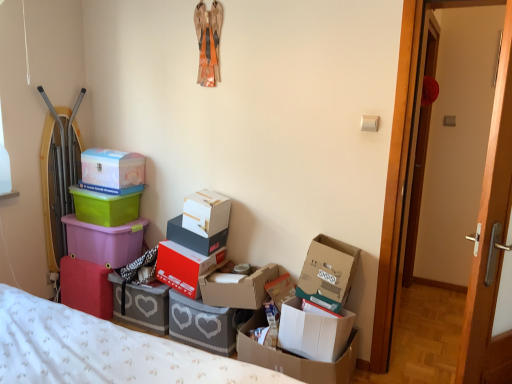
The width and height of the screenshot is (512, 384). What do you see at coordinates (105, 207) in the screenshot? I see `green plastic container at upper left, which is the 2th box from left to right` at bounding box center [105, 207].

Measure the distance between point (478, 251) and camera.

A distance of 4.92 feet exists between point (478, 251) and camera.

What do you see at coordinates (142, 304) in the screenshot?
I see `gray cardboard box at lower center, positioned as the 4th box in left-to-right order` at bounding box center [142, 304].

You are a GUI agent. You are given a task and a screenshot of the screen. Output one action in this format:
    pyautogui.click(x=<x>, y=<y>)
    Task: Click on the gray cardboard box at lower center, positioned as the 4th box in left-to-right order
    
    Given the screenshot: What is the action you would take?
    pyautogui.click(x=142, y=304)

This screenshot has height=384, width=512. What do you see at coordinates (490, 236) in the screenshot?
I see `wooden door at right, the 1th door from the back` at bounding box center [490, 236].

Image resolution: width=512 pixels, height=384 pixels. Find the location of `matte plastic storage box at left, placed as the 12th box when sorted from right to left`. matte plastic storage box at left, placed as the 12th box when sorted from right to left is located at coordinates (105, 241).

From the image's perspective, is matte white plastic box at upper left, which appears as the 3th box when viewed from the left, on gray cardboard box at center, positioned as the 5th box in right-to-left order?

Yes, from the image's perspective, matte white plastic box at upper left, which appears as the 3th box when viewed from the left, is above gray cardboard box at center, positioned as the 5th box in right-to-left order.

Considering the sizes of matte white plastic box at upper left, acting as the tenth box starting from the right, and gray cardboard box at center, positioned as the 5th box in right-to-left order, in the image, is matte white plastic box at upper left, acting as the tenth box starting from the right, wider or thinner than gray cardboard box at center, positioned as the 5th box in right-to-left order,?

matte white plastic box at upper left, acting as the tenth box starting from the right, is thinner than gray cardboard box at center, positioned as the 5th box in right-to-left order.

Which of these two, matte white plastic box at upper left, which appears as the 3th box when viewed from the left, or gray cardboard box at center, positioned as the 5th box in right-to-left order, stands shorter?

Standing shorter between the two is matte white plastic box at upper left, which appears as the 3th box when viewed from the left.

Locate an element on the screen. The height and width of the screenshot is (384, 512). the 10th box above the gray cardboard box at center, positioned as the 5th box in right-to-left order (from the image's perspective) is located at coordinates (112, 168).

Is point (215, 228) less distant than point (110, 233)?

Yes.

How far apart are white cardboard box at center, the 7th box viewed from the left, and matte plastic storage box at left, which is counted as the first box, starting from the left?

They are 26.00 inches apart.

Which of these two, white cardboard box at center, which is counted as the sixth box, starting from the right, or matte plastic storage box at left, which is counted as the first box, starting from the left, is wider?

Wider between the two is matte plastic storage box at left, which is counted as the first box, starting from the left.

How different are the orientations of white cardboard box at center, the 7th box viewed from the left, and matte plastic storage box at left, placed as the 12th box when sorted from right to left, in degrees?

The angle between the facing direction of white cardboard box at center, the 7th box viewed from the left, and the facing direction of matte plastic storage box at left, placed as the 12th box when sorted from right to left, is 3.5 degrees.

In the image, is green plastic container at upper left, positioned as the 11th box in right-to-left order, positioned in front of or behind gray cardboard box at lower center, the 9th box from the right?

Visually, green plastic container at upper left, positioned as the 11th box in right-to-left order, is located behind gray cardboard box at lower center, the 9th box from the right.

From the image's perspective, which is below, green plastic container at upper left, positioned as the 11th box in right-to-left order, or gray cardboard box at lower center, positioned as the 4th box in left-to-right order?

From the image's view, gray cardboard box at lower center, positioned as the 4th box in left-to-right order, is below.

Find the location of `box that is the 7th one when counting downward from the green plastic container at upper left, which is the 2th box from left to right (from the image's perspective)`. box that is the 7th one when counting downward from the green plastic container at upper left, which is the 2th box from left to right (from the image's perspective) is located at coordinates (142, 304).

Is green plastic container at upper left, positioned as the 11th box in right-to-left order, spatially inside gray cardboard box at lower center, the 9th box from the right, or outside of it?

green plastic container at upper left, positioned as the 11th box in right-to-left order, is spatially situated outside gray cardboard box at lower center, the 9th box from the right.

Can you confirm if cardboard box at center, which ranks as the fourth box in right-to-left order, is positioned to the right of matte wood door at right, which ranks as the second door in back-to-front order?

In fact, cardboard box at center, which ranks as the fourth box in right-to-left order, is to the left of matte wood door at right, which ranks as the second door in back-to-front order.

Is the position of cardboard box at center, which ranks as the fourth box in right-to-left order, more distant than that of matte wood door at right, which ranks as the second door in back-to-front order?

Yes, cardboard box at center, which ranks as the fourth box in right-to-left order, is behind matte wood door at right, which ranks as the second door in back-to-front order.

Looking at this image, is cardboard box at center, acting as the 9th box starting from the left, inside the boundaries of matte wood door at right, which ranks as the second door in back-to-front order, or outside?

cardboard box at center, acting as the 9th box starting from the left, is spatially situated outside matte wood door at right, which ranks as the second door in back-to-front order.

Is cardboard box at center, which ranks as the fourth box in right-to-left order, smaller than matte wood door at right, which appears as the 1th door when viewed from the front?

Yes.

Does matte white plastic box at upper left, which appears as the 3th box when viewed from the left, turn towards green plastic container at upper left, which is the 2th box from left to right?

No.

Considering the points (86, 154) and (86, 210), which point is in front, point (86, 154) or point (86, 210)?

The point (86, 210) is in front.

Is green plastic container at upper left, which is the 2th box from left to right, located within matte white plastic box at upper left, acting as the tenth box starting from the right?

No.

Does matte white plastic box at upper left, which appears as the 3th box when viewed from the left, have a lesser width compared to green plastic container at upper left, which is the 2th box from left to right?

No.

From the image's perspective, is gray cardboard box at center, positioned as the 5th box in right-to-left order, located above white cardboard box at center, which is counted as the sixth box, starting from the right?

No, from the image's perspective, gray cardboard box at center, positioned as the 5th box in right-to-left order, is not over white cardboard box at center, which is counted as the sixth box, starting from the right.

From the picture: Between gray cardboard box at center, positioned as the 8th box in left-to-right order, and white cardboard box at center, which is counted as the sixth box, starting from the right, which one appears on the right side from the viewer's perspective?

From the viewer's perspective, gray cardboard box at center, positioned as the 8th box in left-to-right order, appears more on the right side.

Which object is further away from the camera, gray cardboard box at center, positioned as the 5th box in right-to-left order, or white cardboard box at center, the 7th box viewed from the left?

white cardboard box at center, the 7th box viewed from the left, is more distant.

Is matte white plastic box at upper left, acting as the tenth box starting from the right, far away from cardboard box at lower right, arranged as the third box when viewed from the right?

Yes.

From the picture: How far apart are matte white plastic box at upper left, which appears as the 3th box when viewed from the left, and cardboard box at lower right, arranged as the third box when viewed from the right?

They are 1.42 meters apart.

Between matte white plastic box at upper left, acting as the tenth box starting from the right, and cardboard box at lower right, arranged as the third box when viewed from the right, which one has more height?

matte white plastic box at upper left, acting as the tenth box starting from the right.

Is matte white plastic box at upper left, acting as the tenth box starting from the right, oriented towards cardboard box at lower right, arranged as the third box when viewed from the right?

No, matte white plastic box at upper left, acting as the tenth box starting from the right, does not turn towards cardboard box at lower right, arranged as the third box when viewed from the right.

From a real-world perspective, which box is the 10th one underneath the matte white plastic box at upper left, acting as the tenth box starting from the right? Please provide its 2D coordinates.

[(201, 324)]

Image resolution: width=512 pixels, height=384 pixels. I want to click on the 2nd box above when counting from the matte plastic storage box at left, placed as the 12th box when sorted from right to left (from the image's perspective), so click(206, 212).

When comparing their distances from wooden door at right, the 1th door from the back, does cardboard box at center, acting as the 9th box starting from the left, or matte plastic storage box at left, placed as the 12th box when sorted from right to left, seem closer?

cardboard box at center, acting as the 9th box starting from the left.

Looking at the image, which one is located closer to white cardboard box at center, which is counted as the sixth box, starting from the right, gray cardboard box at lower center, the 9th box from the right, or matte wood door at right, which ranks as the second door in back-to-front order?

The object closer to white cardboard box at center, which is counted as the sixth box, starting from the right, is gray cardboard box at lower center, the 9th box from the right.

When comparing their distances from red matte shoebox at center, marked as the fifth box in a left-to-right arrangement, does gray cardboard box at lower center, positioned as the 4th box in left-to-right order, or white cardboard box at center, the 7th box viewed from the left, seem further?

The object further to red matte shoebox at center, marked as the fifth box in a left-to-right arrangement, is white cardboard box at center, the 7th box viewed from the left.

Which object lies further to the anchor point cardboard box at lower right, arranged as the third box when viewed from the right, cardboard box at right, which is counted as the 1th box, starting from the right, or gray cardboard box at lower center, the 9th box from the right?

The object further to cardboard box at lower right, arranged as the third box when viewed from the right, is gray cardboard box at lower center, the 9th box from the right.

Based on their spatial positions, is matte wood door at right, which ranks as the second door in back-to-front order, or gray cardboard box at center, positioned as the 5th box in right-to-left order, closer to cardboard box at lower right, the 10th box from the left?

Based on the image, gray cardboard box at center, positioned as the 5th box in right-to-left order, appears to be nearer to cardboard box at lower right, the 10th box from the left.

Based on their spatial positions, is matte plastic storage box at left, placed as the 12th box when sorted from right to left, or cardboard box at center, which ranks as the fourth box in right-to-left order, further from red matte shoebox at center, marked as the fifth box in a left-to-right arrangement?

Based on the image, matte plastic storage box at left, placed as the 12th box when sorted from right to left, appears to be further to red matte shoebox at center, marked as the fifth box in a left-to-right arrangement.

Considering their positions, is wooden door at right, marked as the 2th door in a front-to-back arrangement, positioned closer to red matte shoebox at center, marked as the fifth box in a left-to-right arrangement, than cardboard box at center, acting as the 9th box starting from the left?

cardboard box at center, acting as the 9th box starting from the left.

Based on their spatial positions, is white cardboard box at center, the 7th box viewed from the left, or white cardboard box at lower right, the second box when ordered from right to left, further from cardboard box at center, which ranks as the fourth box in right-to-left order?

The object further to cardboard box at center, which ranks as the fourth box in right-to-left order, is white cardboard box at center, the 7th box viewed from the left.

Where is `box between gray cardboard box at center, positioned as the 5th box in right-to-left order, and cardboard box at lower right, arranged as the third box when viewed from the right`? This screenshot has height=384, width=512. box between gray cardboard box at center, positioned as the 5th box in right-to-left order, and cardboard box at lower right, arranged as the third box when viewed from the right is located at coordinates (237, 287).

Image resolution: width=512 pixels, height=384 pixels. In order to click on door between white cardboard box at center, the 7th box viewed from the left, and wooden door at right, the 1th door from the back, from left to right in this screenshot , I will do `click(490, 240)`.

In order to click on door situated between cardboard box at center, acting as the 9th box starting from the left, and wooden door at right, the 1th door from the back, from left to right in this screenshot , I will do `click(490, 240)`.

Identify the location of door between matte plastic storage box at left, which is counted as the first box, starting from the left, and wooden door at right, marked as the 2th door in a front-to-back arrangement, from left to right. This screenshot has height=384, width=512. (490, 240).